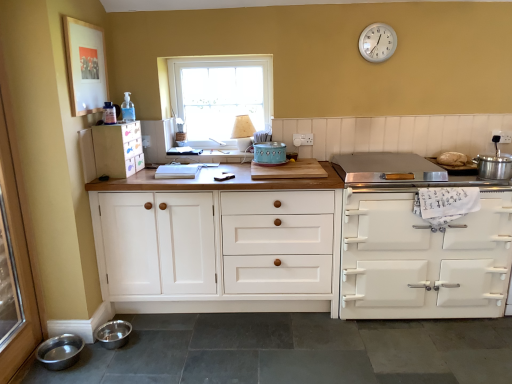
Question: Does point tap(7, 337) appear closer or farther from the camera than point tap(378, 271)?

Choices:
 (A) closer
 (B) farther

Answer: (A)

Question: From the image's perspective, is transparent glass screen door at left located above or below white glossy stove at right, the first cabinetry in the right-to-left sequence?

Choices:
 (A) above
 (B) below

Answer: (A)

Question: Considering the real-world distances, which object is farthest from the white painted wood cabinet at left, which is the third cabinetry in right-to-left order?

Choices:
 (A) white wood cabinet at center, which is the 2th cabinetry in right-to-left order
 (B) white glossy stove at right, the first cabinetry in the right-to-left sequence
 (C) clear glass window at center
 (D) transparent glass screen door at left
 (E) silver metallic bowl at lower left, the 1th bowl positioned from the right

Answer: (B)

Question: Which of these objects is positioned farthest from the stainless steel bowl at lower left, positioned as the 2th bowl in right-to-left order?

Choices:
 (A) white wood cabinet at center, which is the 2th cabinetry in right-to-left order
 (B) transparent glass screen door at left
 (C) teal ceramic pot at center, positioned as the first appliance in left-to-right order
 (D) silver metallic bowl at lower left, which is the 2th bowl from left to right
 (E) silver metallic clock at upper right

Answer: (E)